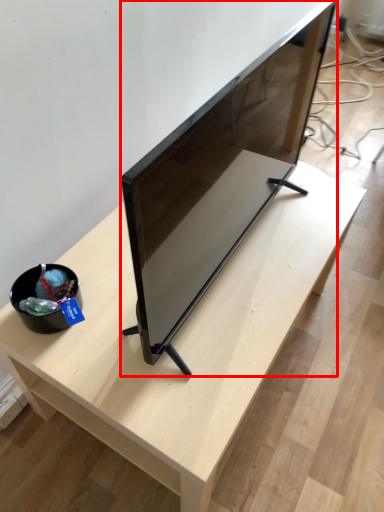
Question: Observing the image, what is the correct spatial positioning of television (annotated by the red box) in reference to table?

Choices:
 (A) right
 (B) left

Answer: (A)